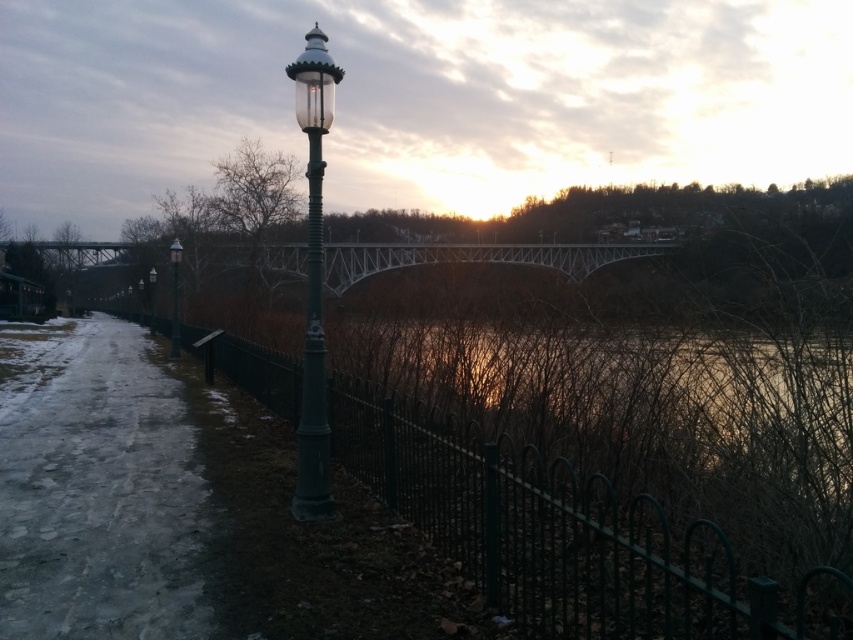
Question: Is icy concrete path at lower left thinner than matte green pole at center?

Choices:
 (A) no
 (B) yes

Answer: (A)

Question: Does icy concrete path at lower left come in front of matte green pole at center?

Choices:
 (A) no
 (B) yes

Answer: (B)

Question: Which of the following is the farthest from the observer?

Choices:
 (A) green matte lamp post at center
 (B) white metallic bridge at center

Answer: (B)

Question: Which point is closer to the camera taking this photo?

Choices:
 (A) coord(310,33)
 (B) coord(149,324)

Answer: (A)

Question: Can you confirm if white metallic bridge at center is bigger than green matte lamp post at center?

Choices:
 (A) no
 (B) yes

Answer: (B)

Question: Which is farther from the green matte lamp post at center?

Choices:
 (A) green wrought iron fence at center
 (B) green glass street light at left
 (C) matte green pole at center
 (D) white metallic bridge at center

Answer: (C)